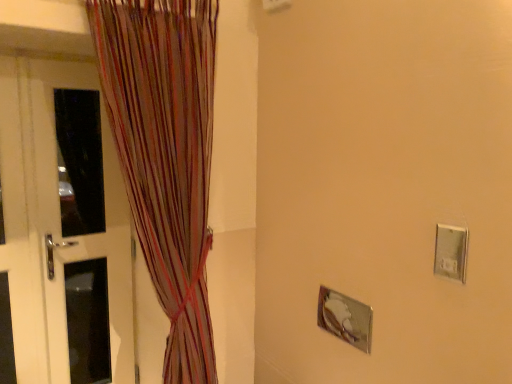
Question: From a real-world perspective, is white glossy door at left located higher than silver metallic electric outlet at right?

Choices:
 (A) yes
 (B) no

Answer: (B)

Question: Is the surface of white glossy door at left in direct contact with silver metallic electric outlet at right?

Choices:
 (A) yes
 (B) no

Answer: (B)

Question: From a real-world perspective, is white glossy door at left positioned under silver metallic electric outlet at right based on gravity?

Choices:
 (A) yes
 (B) no

Answer: (A)

Question: Is white glossy door at left to the left of silver metallic electric outlet at right from the viewer's perspective?

Choices:
 (A) yes
 (B) no

Answer: (A)

Question: From the image's perspective, is white glossy door at left located above silver metallic electric outlet at right?

Choices:
 (A) no
 (B) yes

Answer: (A)

Question: Considering their positions, is white glossy door at left located in front of or behind silver metallic electric outlet at right?

Choices:
 (A) behind
 (B) front

Answer: (A)

Question: Considering the positions of white glossy door at left and silver metallic electric outlet at right in the image, is white glossy door at left wider or thinner than silver metallic electric outlet at right?

Choices:
 (A) thin
 (B) wide

Answer: (B)

Question: Considering the positions of white glossy door at left and silver metallic electric outlet at right in the image, is white glossy door at left taller or shorter than silver metallic electric outlet at right?

Choices:
 (A) short
 (B) tall

Answer: (B)

Question: From a real-world perspective, is white glossy door at left positioned above or below silver metallic electric outlet at right?

Choices:
 (A) below
 (B) above

Answer: (A)

Question: In terms of width, does silver metallic electric outlet at right look wider or thinner when compared to multicolored striped curtain at left?

Choices:
 (A) wide
 (B) thin

Answer: (B)

Question: In terms of size, does silver metallic electric outlet at right appear bigger or smaller than multicolored striped curtain at left?

Choices:
 (A) small
 (B) big

Answer: (A)

Question: From the image's perspective, relative to multicolored striped curtain at left, is silver metallic electric outlet at right above or below?

Choices:
 (A) above
 (B) below

Answer: (B)

Question: Considering the positions of point 443,243 and point 174,28, is point 443,243 closer or farther from the camera than point 174,28?

Choices:
 (A) farther
 (B) closer

Answer: (B)

Question: Based on their sizes in the image, would you say silver metallic electric outlet at right is bigger or smaller than white glossy door at left?

Choices:
 (A) small
 (B) big

Answer: (A)

Question: Would you say silver metallic electric outlet at right is to the left or to the right of white glossy door at left in the picture?

Choices:
 (A) left
 (B) right

Answer: (B)